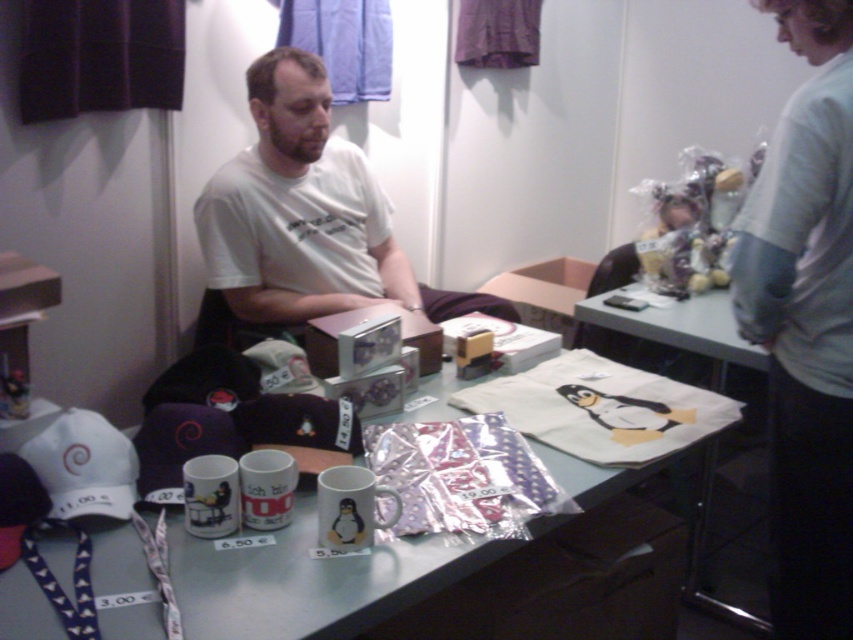
You are a customer at the stall and want to pick up the gray sweater at right and the white paper bag at center. Which item should you reach for first if you want to grab both items starting from the leftmost one?

The gray sweater at right is positioned on the left side of white paper bag at center, so you should reach for the gray sweater at right first.